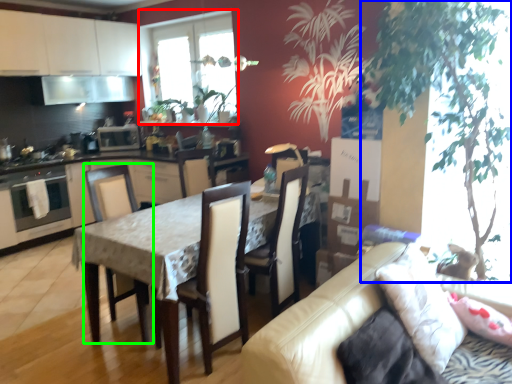
Question: Which object is the closest to the window (highlighted by a red box)? Choose among these: plant (highlighted by a blue box) or chair (highlighted by a green box).

Choices:
 (A) plant
 (B) chair

Answer: (B)